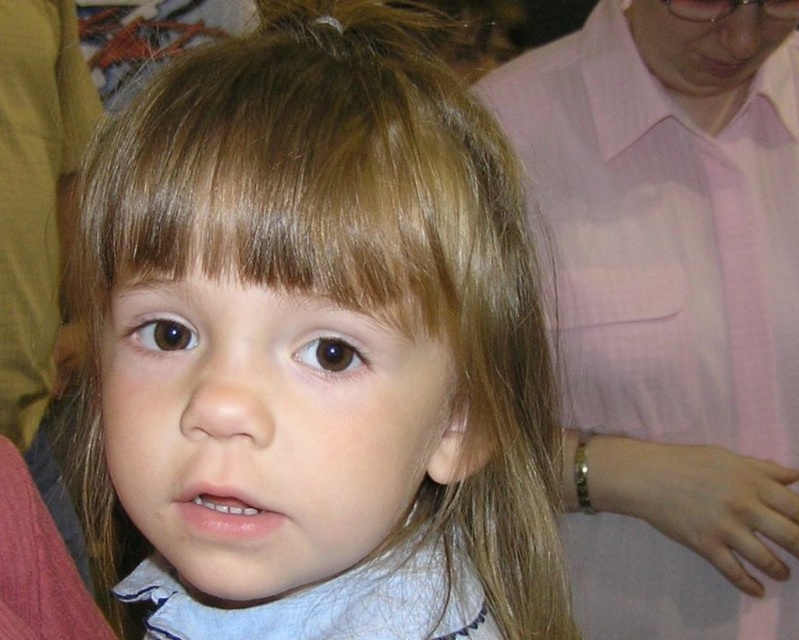
You are a photographer adjusting the focus on your camera. You want to ensure both the blonde hair at center and the pink fabric shirt at upper right are clearly visible. Which object should you adjust the focus for first to maintain clarity, considering their sizes?

The blonde hair at center is thinner than the pink fabric shirt at upper right, so you should focus on the thinner blonde hair at center first to ensure it remains clear before adjusting for the larger pink fabric shirt at upper right.